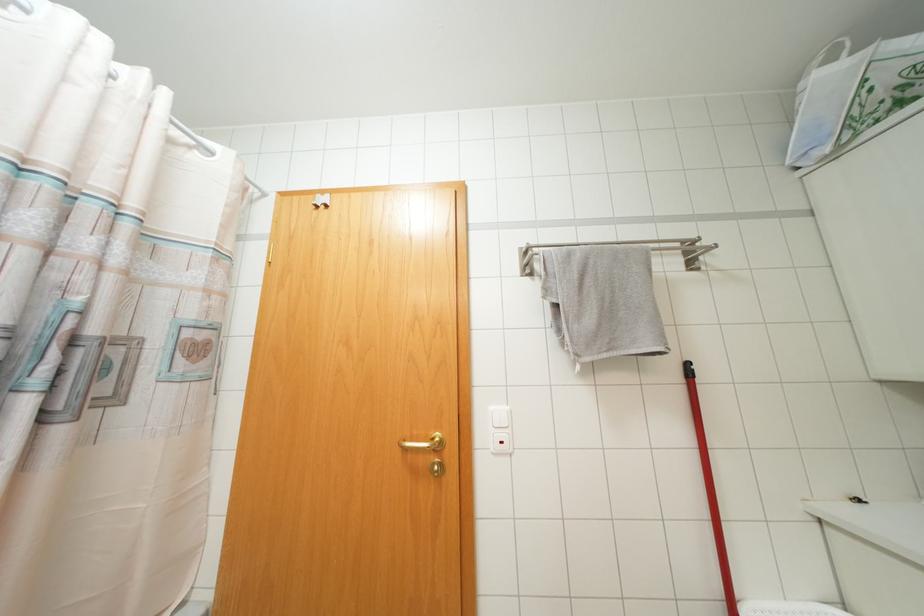
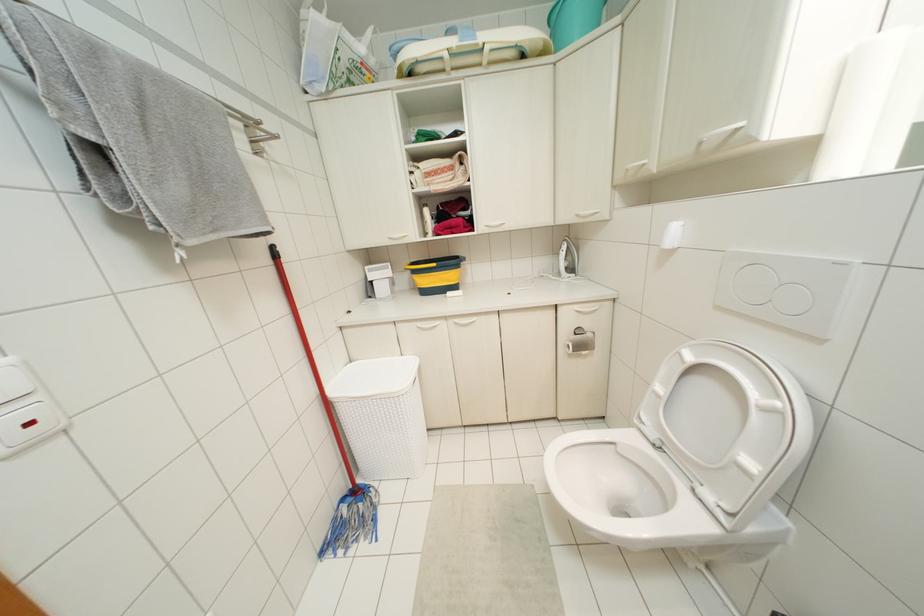
Where in the second image is the point corresponding to (x=686, y=363) from the first image?

(273, 246)